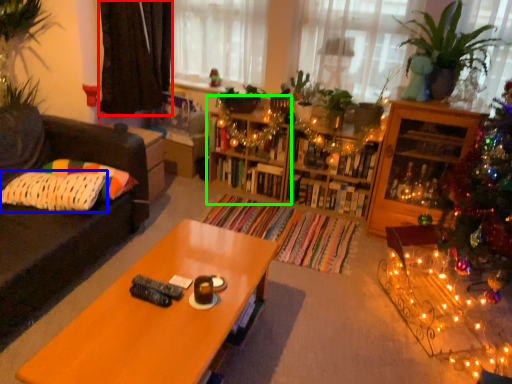
Question: Based on their relative distances, which object is farther from curtain (highlighted by a red box)? Choose from pillow (highlighted by a blue box) and shelf (highlighted by a green box).

Choices:
 (A) pillow
 (B) shelf

Answer: (A)